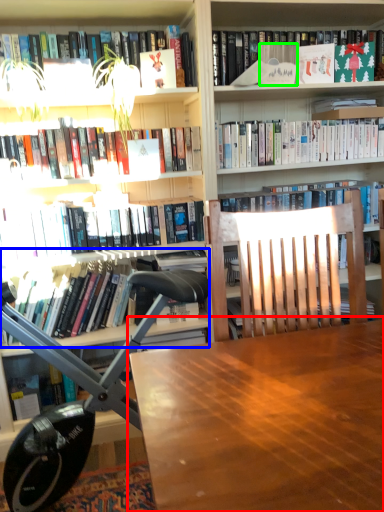
Question: Which is nearer to the table (highlighted by a red box)? book (highlighted by a blue box) or paperback book (highlighted by a green box).

Choices:
 (A) book
 (B) paperback book

Answer: (A)